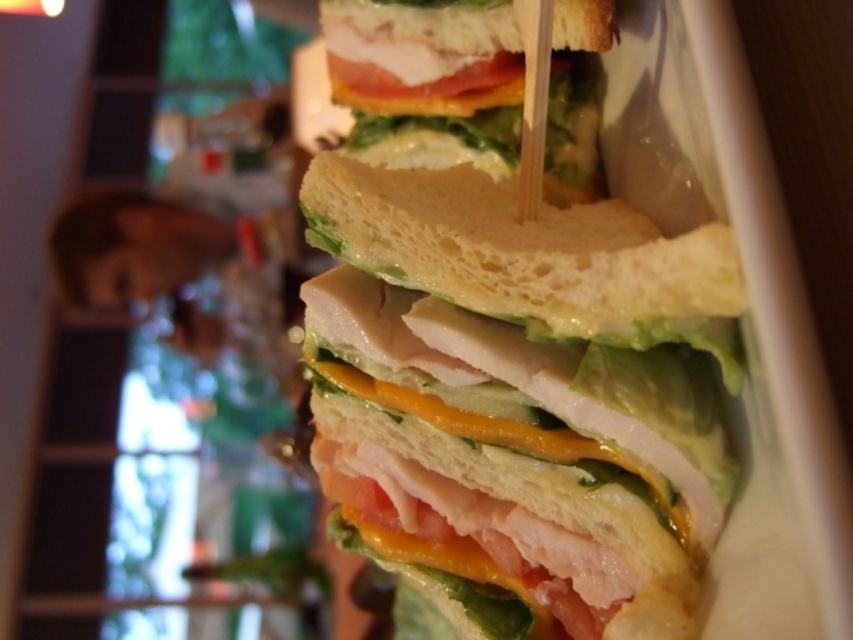
Is white bread sandwich at center taller than slightly toasted bread at center?

Correct, white bread sandwich at center is much taller as slightly toasted bread at center.

Who is more forward, (364, 180) or (364, 124)?

Point (364, 180) is more forward.

In order to click on white bread sandwich at center in this screenshot , I will do `click(521, 394)`.

Locate an element on the screen. white bread sandwich at center is located at coordinates (521, 394).